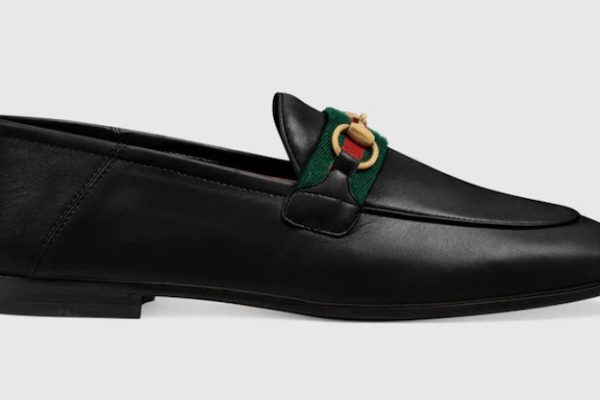
The image size is (600, 400). In order to click on table in this screenshot , I will do `click(227, 349)`.